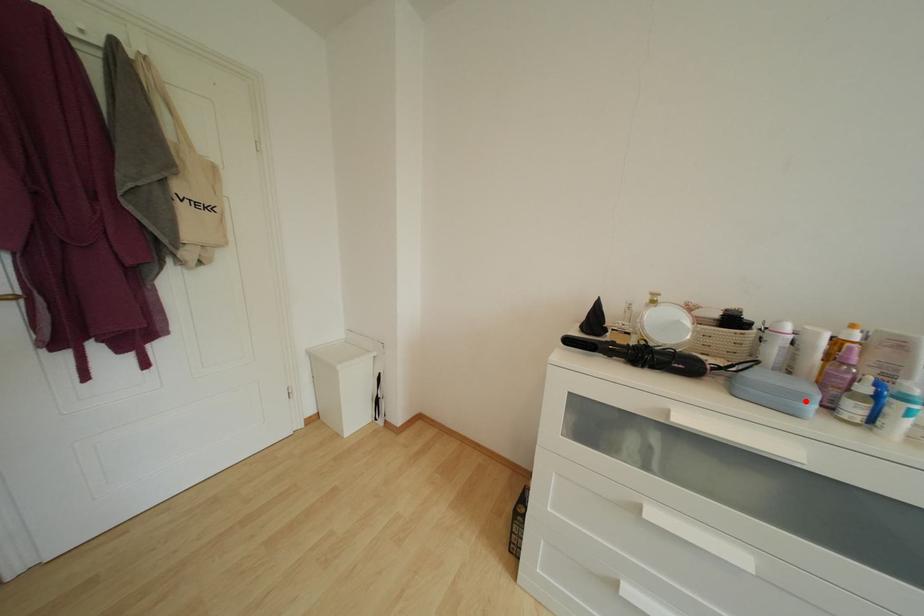
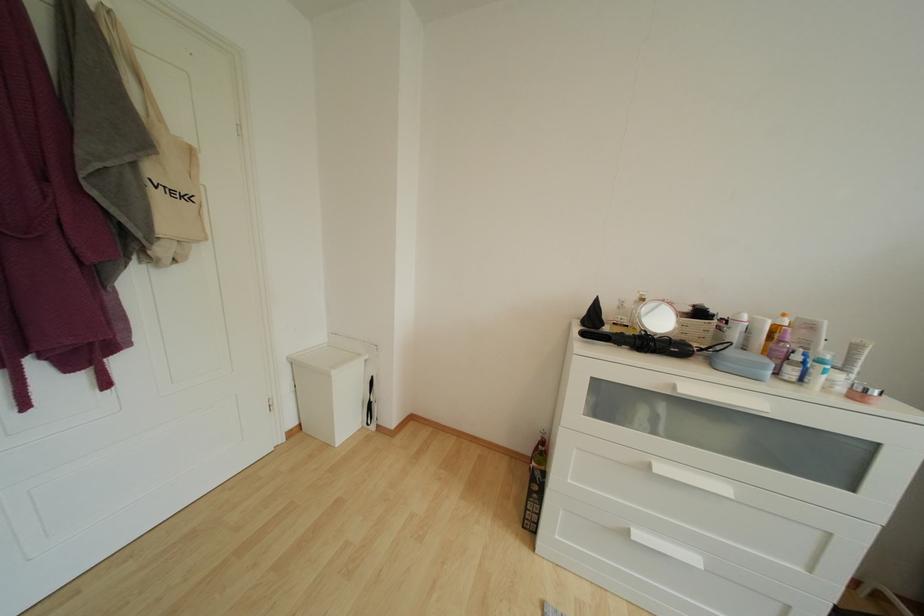
Find the pixel in the second image that matches the highlighted location in the first image.

(767, 370)